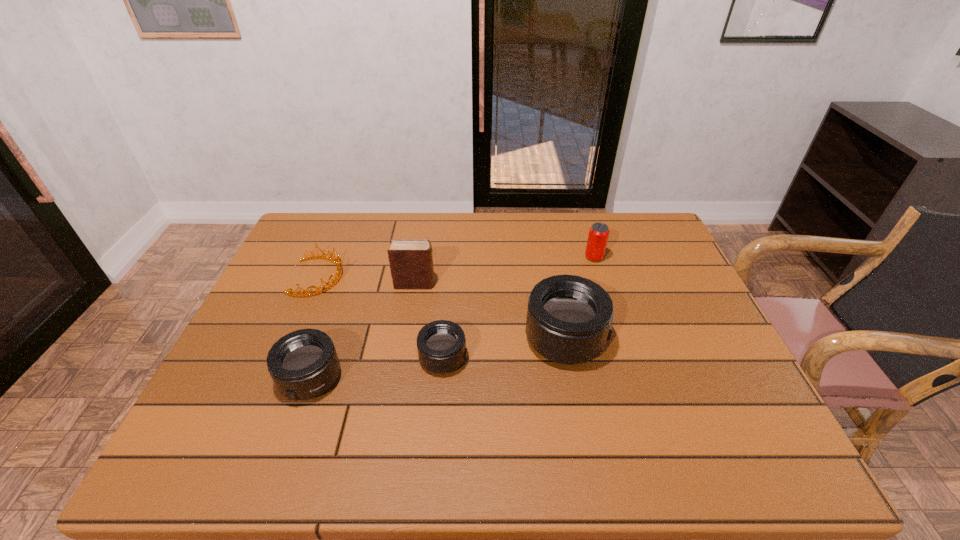
What are the coordinates of `free space that satisfies the following two spatial constraints: 1. on the side of the second telephoto lens from right to left with brand markings and control switches; 2. on the side of the leftmost telephoto lens with brand markings and control switches` in the screenshot? It's located at pos(442,379).

I want to click on vacant region that satisfies the following two spatial constraints: 1. on the spine side of the diary; 2. on the side of the second shortest telephoto lens with brand markings and control switches, so click(399, 379).